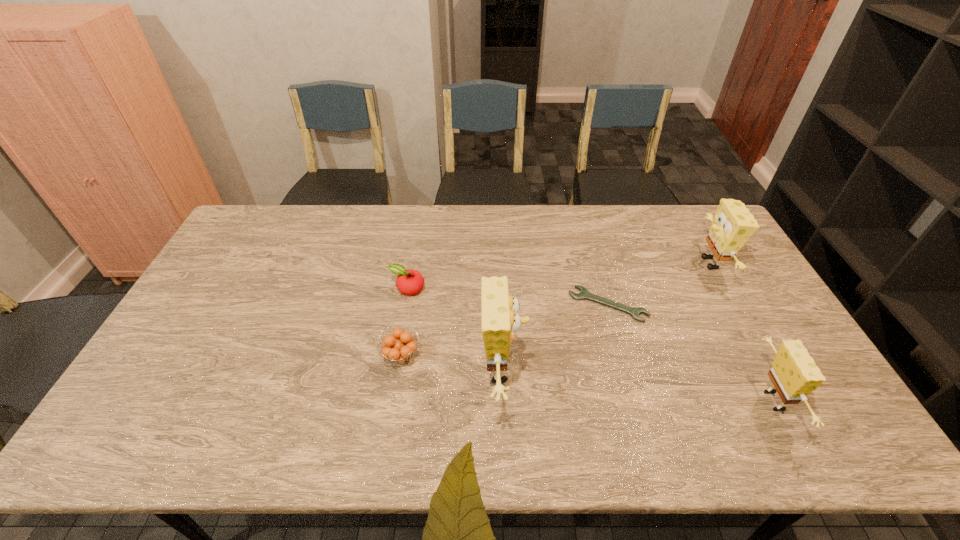
Locate an element on the screen. The height and width of the screenshot is (540, 960). vacant space at the far edge is located at coordinates (575, 224).

This screenshot has height=540, width=960. I want to click on vacant space at the left edge of the desktop, so click(x=212, y=328).

In the image, there is a desktop. Identify the location of vacant space at the far right corner. This screenshot has width=960, height=540. (681, 205).

Where is `vacant area that lies between the shortest sponge and the apple`? vacant area that lies between the shortest sponge and the apple is located at coordinates (591, 345).

Where is `free area in between the apple and the leftmost sponge`? This screenshot has width=960, height=540. free area in between the apple and the leftmost sponge is located at coordinates (455, 329).

Identify the location of vacant space that's between the apple and the second shortest sponge. Image resolution: width=960 pixels, height=540 pixels. (559, 276).

The height and width of the screenshot is (540, 960). In order to click on vacant space that is in between the apple and the tallest object in this screenshot , I will do `click(455, 329)`.

I want to click on vacant region between the fifth shortest object and the shortest object, so click(x=660, y=284).

This screenshot has height=540, width=960. What are the coordinates of `free spot between the apple and the third object from left to right` in the screenshot? It's located at (455, 329).

Identify the location of vacant area that lies between the tallest sponge and the apple. (455, 329).